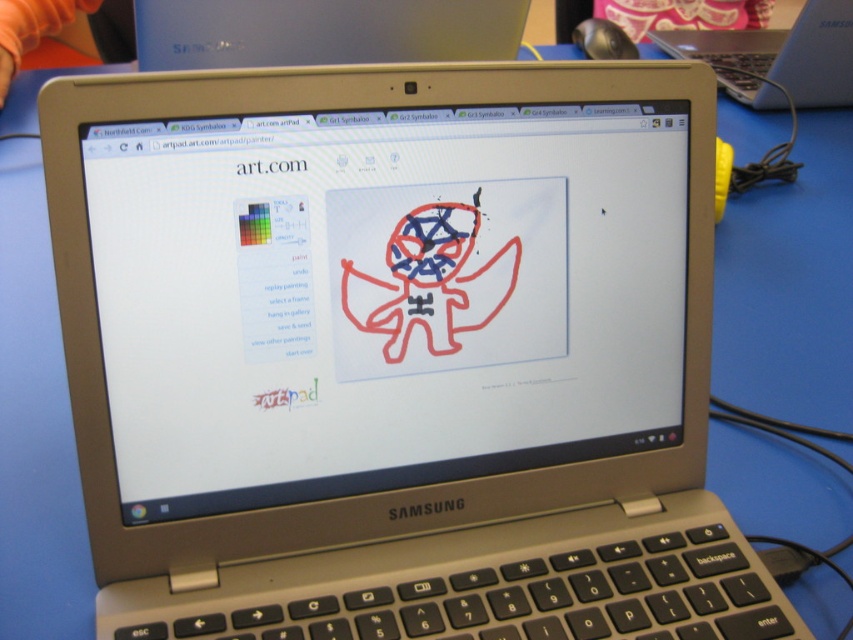
Based on the photo, does white glossy computer screen at center appear on the right side of silver metallic laptop at upper center?

Incorrect, white glossy computer screen at center is not on the right side of silver metallic laptop at upper center.

Is point (616, 262) positioned behind point (753, 29)?

No.

You are a GUI agent. You are given a task and a screenshot of the screen. Output one action in this format:
    pyautogui.click(x=<x>, y=<y>)
    Task: Click on the white glossy computer screen at center
    The image size is (853, 640).
    Given the screenshot: What is the action you would take?
    pyautogui.click(x=384, y=296)

I want to click on white glossy computer screen at center, so click(x=384, y=296).